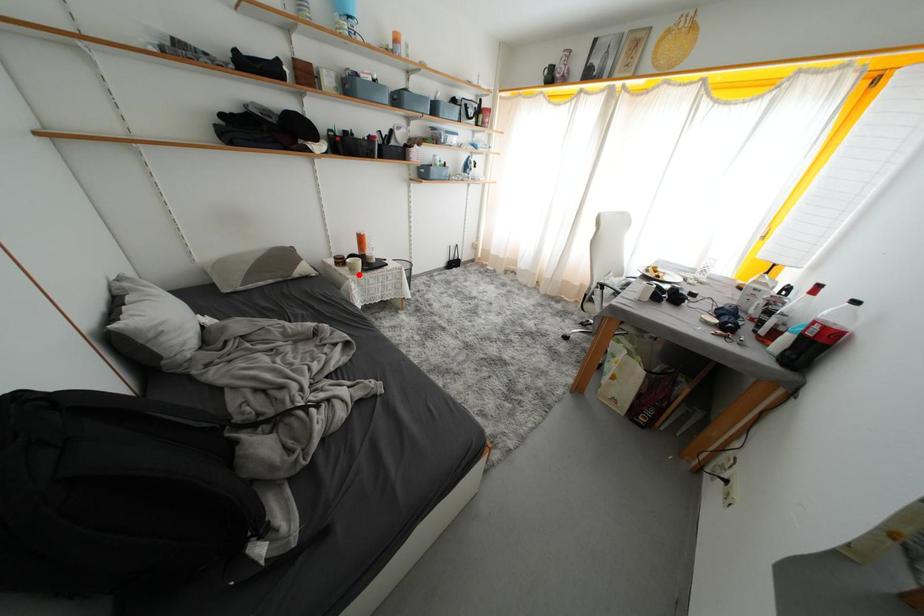
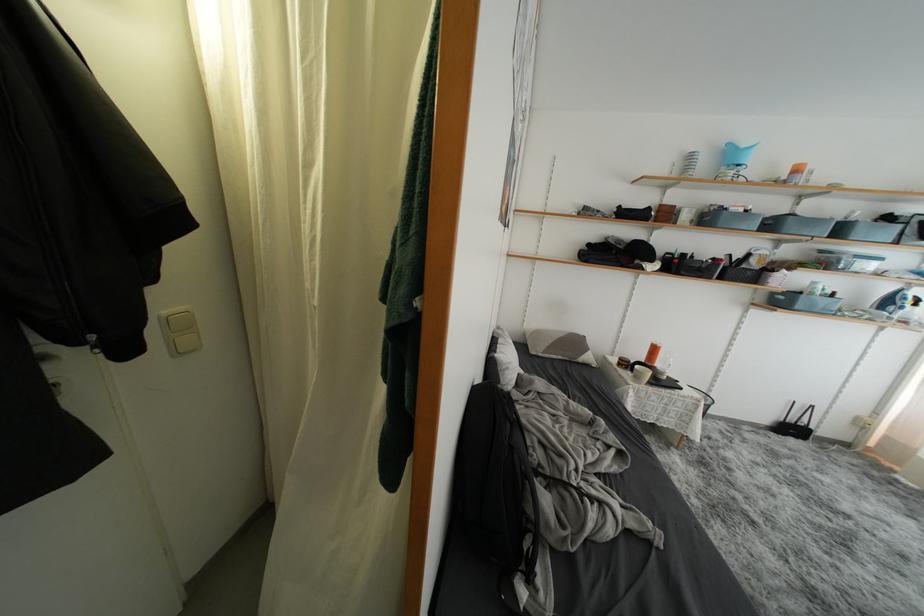
Locate, in the second image, the point that corresponds to the highlighted location in the first image.

(642, 382)